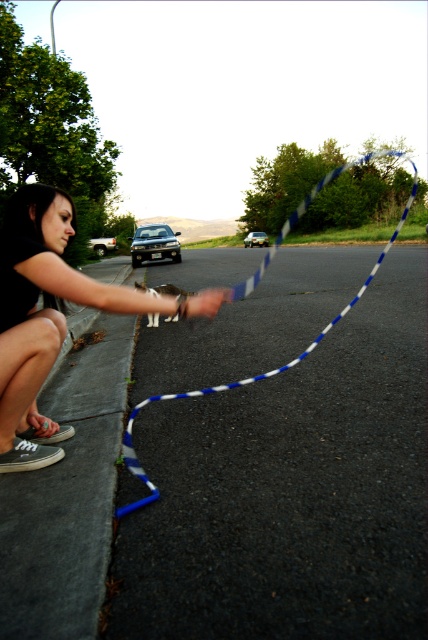
Question: Which object is the farthest from the satin silver sedan at center?

Choices:
 (A) silver metallic sedan at center
 (B) matte black sneakers at lower left

Answer: (B)

Question: Does matte black sneakers at lower left appear on the right side of satin silver sedan at center?

Choices:
 (A) no
 (B) yes

Answer: (B)

Question: Is matte black sneakers at lower left to the left of satin silver sedan at center from the viewer's perspective?

Choices:
 (A) yes
 (B) no

Answer: (B)

Question: Which of these objects is positioned farthest from the silver metallic sedan at left?

Choices:
 (A) silver metallic sedan at center
 (B) satin silver sedan at center
 (C) matte black sneakers at lower left

Answer: (C)

Question: In this image, where is matte black sneakers at lower left located relative to satin silver sedan at center?

Choices:
 (A) left
 (B) right

Answer: (B)

Question: Among these points, which one is farthest from the camera?

Choices:
 (A) (142, 243)
 (B) (314, 196)

Answer: (B)